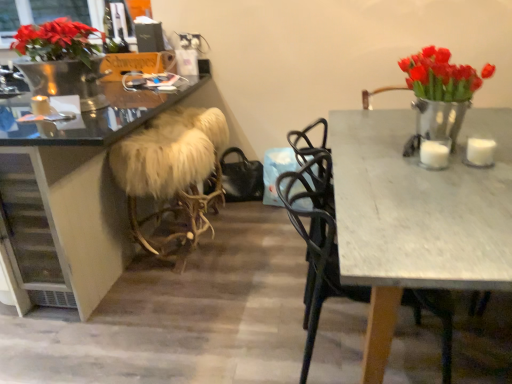
Question: Considering the relative sizes of white marble table at right and white fur-covered stool at center in the image provided, is white marble table at right bigger than white fur-covered stool at center?

Choices:
 (A) no
 (B) yes

Answer: (B)

Question: Is white marble table at right thinner than white fur-covered stool at center?

Choices:
 (A) yes
 (B) no

Answer: (B)

Question: From a real-world perspective, is white marble table at right physically below white fur-covered stool at center?

Choices:
 (A) yes
 (B) no

Answer: (B)

Question: Is the position of white marble table at right less distant than that of white fur-covered stool at center?

Choices:
 (A) yes
 (B) no

Answer: (A)

Question: Is white marble table at right next to white fur-covered stool at center?

Choices:
 (A) no
 (B) yes

Answer: (A)

Question: Is white marble table at right bigger or smaller than white matte candle at right, the 2th candle positioned from the back?

Choices:
 (A) big
 (B) small

Answer: (A)

Question: Is white marble table at right inside or outside of white matte candle at right, the second candle when ordered from top to bottom?

Choices:
 (A) inside
 (B) outside

Answer: (B)

Question: From their relative heights in the image, would you say white marble table at right is taller or shorter than white matte candle at right, the second candle when ordered from top to bottom?

Choices:
 (A) tall
 (B) short

Answer: (A)

Question: From the image's perspective, is white marble table at right positioned above or below white matte candle at right, the third candle in the left-to-right sequence?

Choices:
 (A) above
 (B) below

Answer: (B)

Question: Is white fur-covered stool at center wider or thinner than white matte candle at left, arranged as the 1th candle when viewed from the top?

Choices:
 (A) wide
 (B) thin

Answer: (A)

Question: Would you say white fur-covered stool at center is inside or outside white matte candle at left, positioned as the 3th candle in front-to-back order?

Choices:
 (A) inside
 (B) outside

Answer: (B)

Question: Is white fur-covered stool at center in front of or behind white matte candle at left, which is counted as the 3th candle, starting from the right, in the image?

Choices:
 (A) front
 (B) behind

Answer: (B)

Question: Is point (109, 155) closer or farther from the camera than point (46, 107)?

Choices:
 (A) closer
 (B) farther

Answer: (B)

Question: In terms of width, does white fur-covered stool at center look wider or thinner when compared to white matte candle at right, placed as the 2th candle when sorted from front to back?

Choices:
 (A) thin
 (B) wide

Answer: (B)

Question: Considering the positions of point (164, 150) and point (489, 163), is point (164, 150) closer or farther from the camera than point (489, 163)?

Choices:
 (A) farther
 (B) closer

Answer: (A)